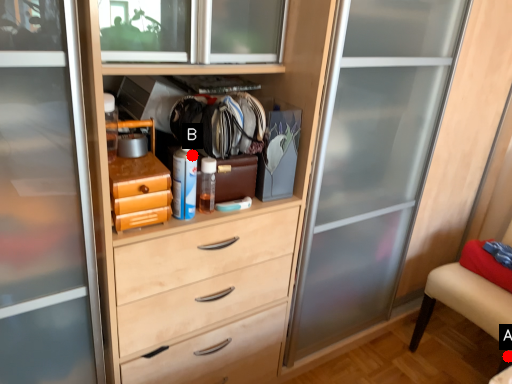
Question: Two points are circled on the image, labeled by A and B beside each circle. Which point is closer to the camera?

Choices:
 (A) A is closer
 (B) B is closer

Answer: (B)